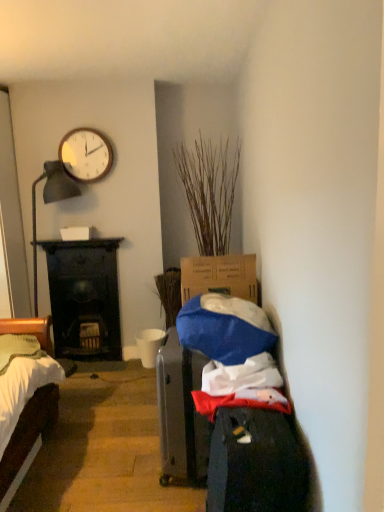
Where is `free point above wooden clock at upper left (from a real-world perspective)`? The width and height of the screenshot is (384, 512). free point above wooden clock at upper left (from a real-world perspective) is located at coordinates (76, 125).